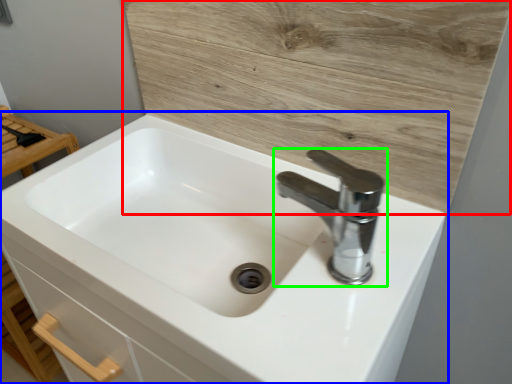
Question: Which object is the closest to the plywood (highlighted by a red box)? Choose among these: sink (highlighted by a blue box) or tap (highlighted by a green box).

Choices:
 (A) sink
 (B) tap

Answer: (B)